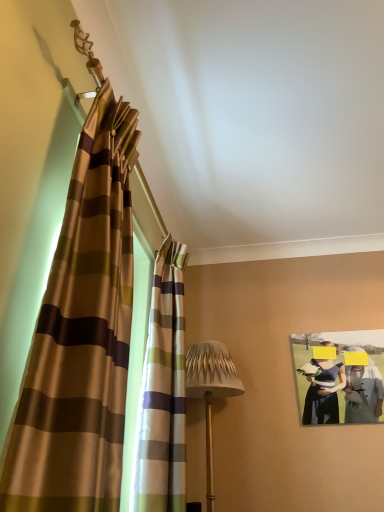
Question: From the image's perspective, is striped fabric curtain at left, which is the 2th curtain in front-to-back order, positioned above or below silky brown striped curtain at left, the second curtain viewed from the back?

Choices:
 (A) above
 (B) below

Answer: (B)

Question: From a real-world perspective, relative to silky brown striped curtain at left, the second curtain viewed from the back, is striped fabric curtain at left, which is the first curtain from back to front, vertically above or below?

Choices:
 (A) above
 (B) below

Answer: (B)

Question: Which object is the closest to the matte paper photo frame at upper right?

Choices:
 (A) striped fabric curtain at left, which is the 2th curtain in front-to-back order
 (B) textured beige lampshade at center
 (C) silky brown striped curtain at left, the second curtain viewed from the back

Answer: (B)

Question: Estimate the real-world distances between objects in this image. Which object is closer to the striped fabric curtain at left, which is the first curtain from back to front?

Choices:
 (A) matte paper photo frame at upper right
 (B) textured beige lampshade at center
 (C) silky brown striped curtain at left, the second curtain viewed from the back

Answer: (B)